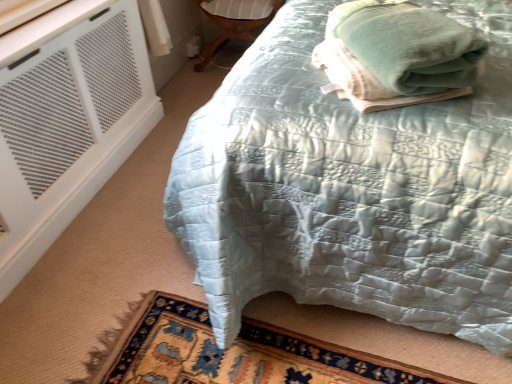
Identify the location of free space in front of white mesh air conditioning at lower left. (92, 267).